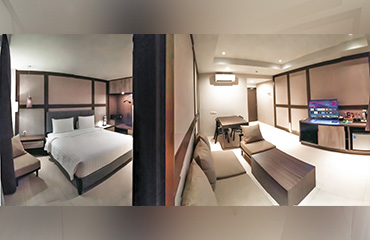
Where is `chairs`? chairs is located at coordinates (27, 165), (256, 142), (219, 131), (241, 134), (236, 126), (216, 122).